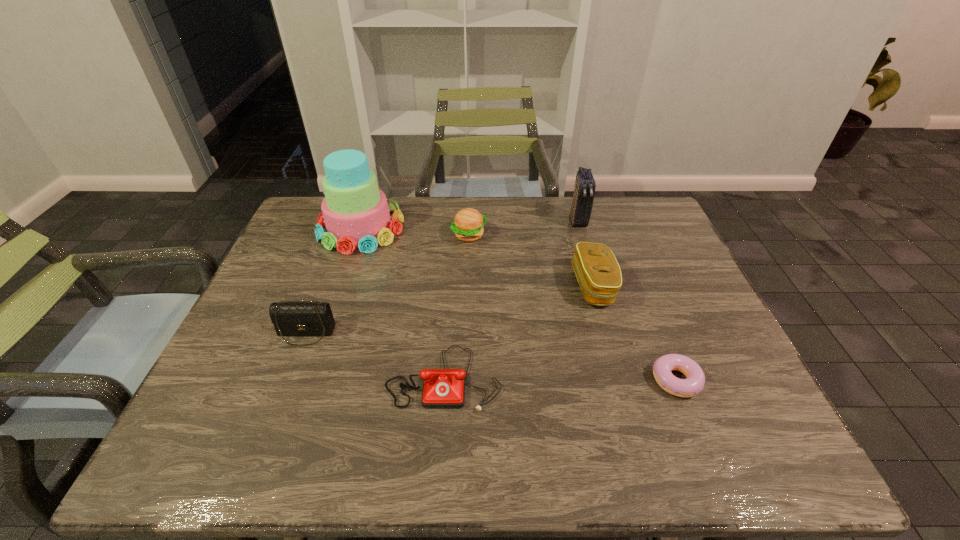
At what (x,y) coordinates should I click in order to perform the action: click on free space at the far right corner. Please return your answer as a coordinate pair (x, y). Looking at the image, I should click on (661, 235).

I want to click on free spot between the second shortest object and the fourth nearest object, so click(x=518, y=332).

The image size is (960, 540). What are the coordinates of `free area in between the cake and the sixth tallest object` in the screenshot? It's located at (402, 302).

Image resolution: width=960 pixels, height=540 pixels. What are the coordinates of `free spot between the second shortest object and the farthest clutch bag` in the screenshot? It's located at (511, 299).

Image resolution: width=960 pixels, height=540 pixels. Find the location of `vacant area that lies between the farthest clutch bag and the nearest clutch bag`. vacant area that lies between the farthest clutch bag and the nearest clutch bag is located at coordinates (442, 277).

This screenshot has width=960, height=540. Identify the location of vacant area between the tallest clutch bag and the leftmost clutch bag. (442, 277).

Locate an element on the screen. This screenshot has width=960, height=540. free space between the nearest clutch bag and the tallest object is located at coordinates (333, 280).

Find the location of a particular element. free spot between the hamburger and the farthest clutch bag is located at coordinates (523, 228).

At what (x,y) coordinates should I click in order to perform the action: click on free point between the telephone and the hamburger. Please return your answer as a coordinate pair (x, y). This screenshot has height=540, width=960. Looking at the image, I should click on tap(457, 306).

Identify the location of free space between the tallest object and the telephone. The image size is (960, 540). (402, 302).